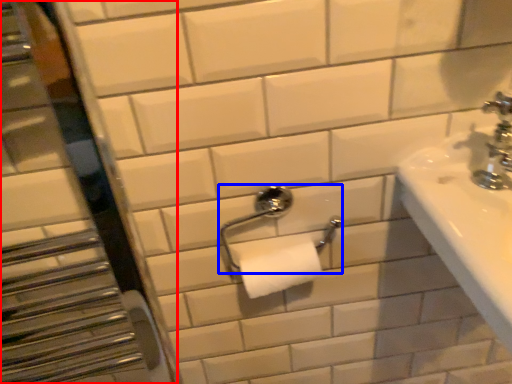
Question: Which point is further to the camera, mirror (highlighted by a red box) or towel bar (highlighted by a blue box)?

Choices:
 (A) mirror
 (B) towel bar

Answer: (B)